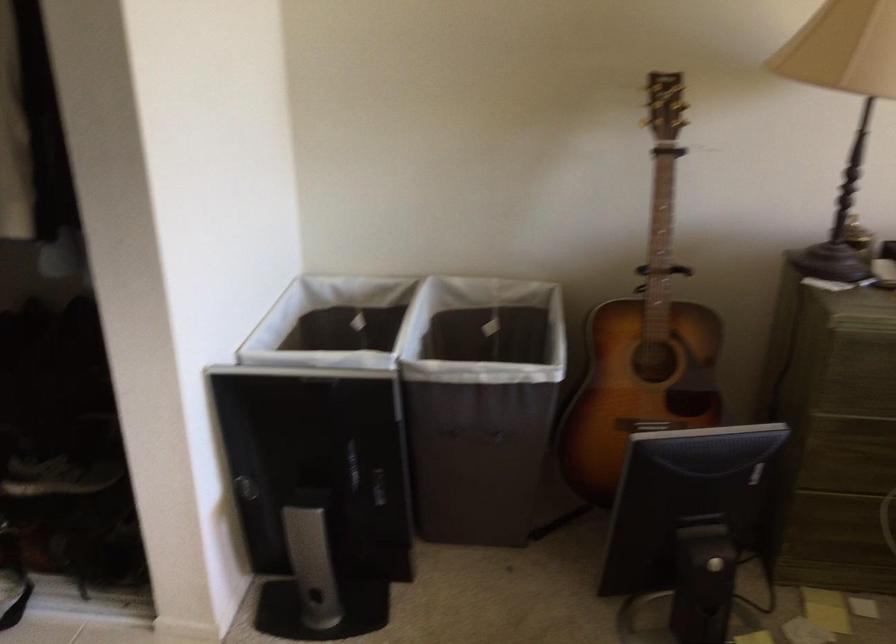
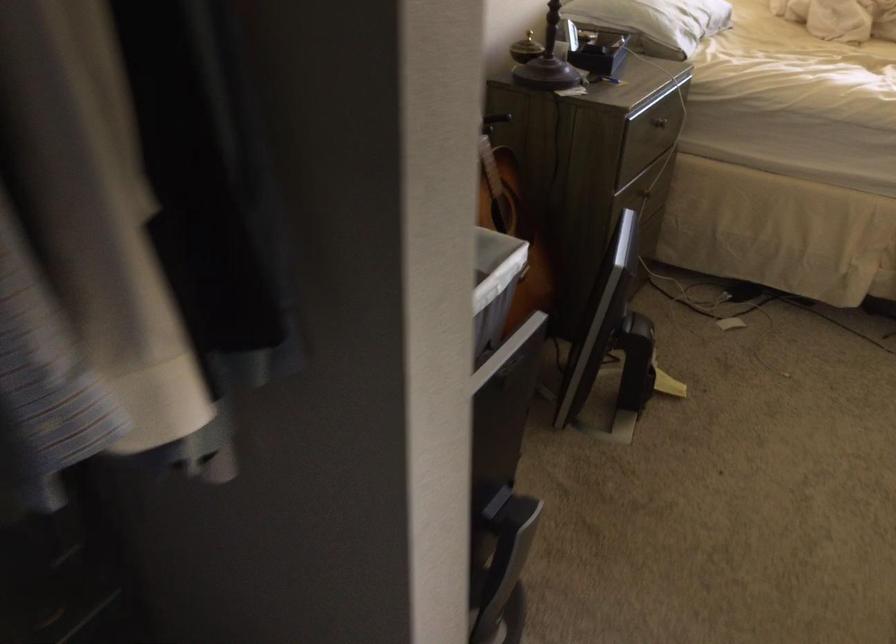
In the second image, find the point that corresponds to pixel 492 372 in the first image.

(494, 286)